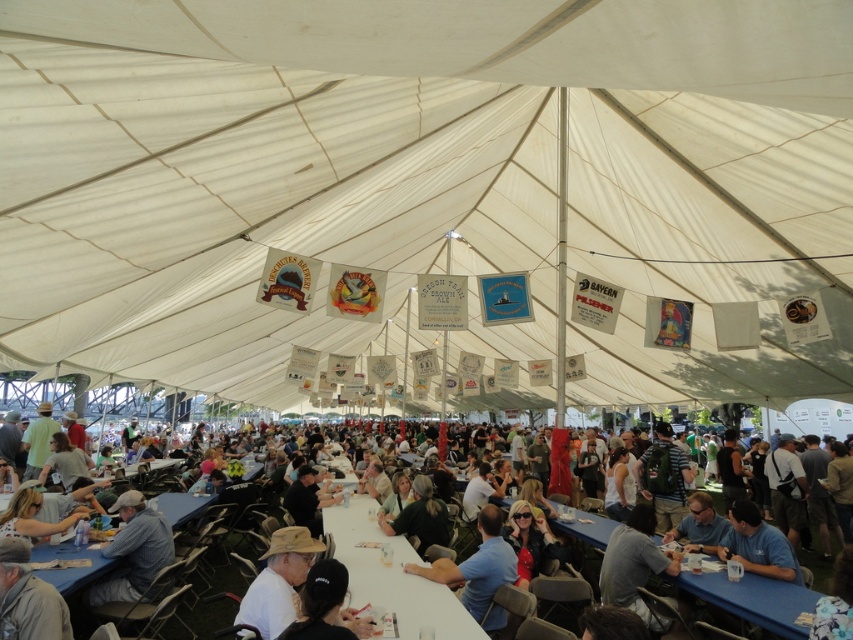
Question: Which object is closer to the camera taking this photo?

Choices:
 (A) gray fabric shirt at lower right
 (B) light brown leather jacket at lower left
 (C) blue plaid shirt at lower left
 (D) white fabric table at center

Answer: (B)

Question: Which point is farther from the camera taking this photo?

Choices:
 (A) (120, 541)
 (B) (543, 496)
 (C) (618, 528)

Answer: (B)

Question: Is gray fabric shirt at lower right thinner than light brown leather jacket at lower left?

Choices:
 (A) yes
 (B) no

Answer: (B)

Question: Does white fabric canopy at center have a smaller size compared to black matte shirt at center?

Choices:
 (A) no
 (B) yes

Answer: (A)

Question: Which point is farther to the camera?

Choices:
 (A) (827, 412)
 (B) (648, 524)

Answer: (A)

Question: Can you confirm if gray fabric shirt at lower right is bigger than light brown leather jacket at lower left?

Choices:
 (A) no
 (B) yes

Answer: (B)